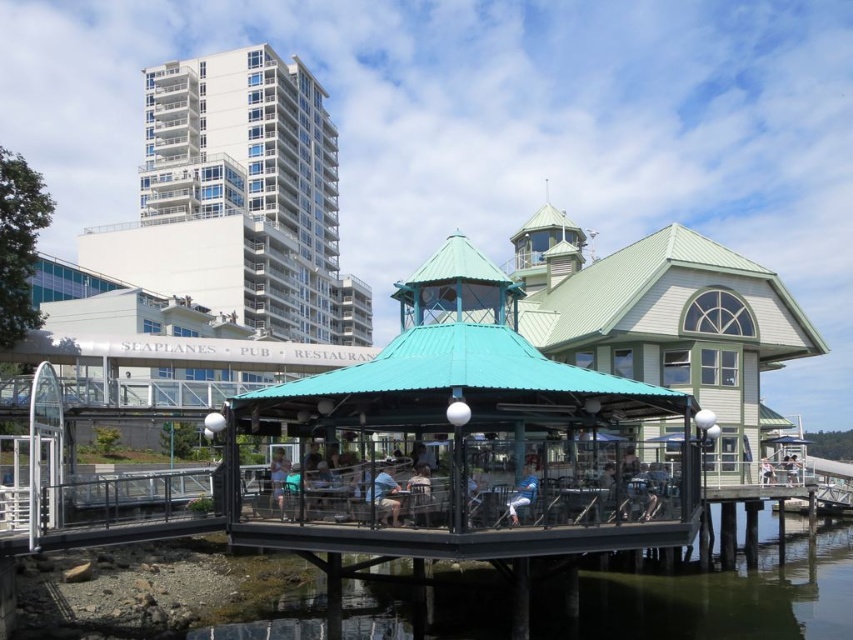
Can you confirm if clear water at lower center is positioned above light blue fabric shirt at center?

Incorrect, clear water at lower center is not positioned above light blue fabric shirt at center.

Which is below, clear water at lower center or light blue fabric shirt at center?

clear water at lower center is below.

Between point (532, 602) and point (274, 483), which one is positioned in front?

Point (274, 483) is in front.

The width and height of the screenshot is (853, 640). Find the location of `clear water at lower center`. clear water at lower center is located at coordinates (730, 596).

Does clear water at lower center have a larger size compared to blue denim jeans at lower center?

Correct, clear water at lower center is larger in size than blue denim jeans at lower center.

Does clear water at lower center have a lesser width compared to blue denim jeans at lower center?

No.

Between point (840, 531) and point (529, 483), which one is positioned behind?

The point (840, 531) is behind.

The width and height of the screenshot is (853, 640). I want to click on clear water at lower center, so click(x=730, y=596).

Is clear water at lower center positioned in front of light blue fabric jacket at center?

Yes, it is.

Who is lower down, clear water at lower center or light blue fabric jacket at center?

Positioned lower is clear water at lower center.

Between point (816, 586) and point (764, 477), which one is positioned behind?

The point (764, 477) is more distant.

Locate an element on the screen. The height and width of the screenshot is (640, 853). clear water at lower center is located at coordinates (730, 596).